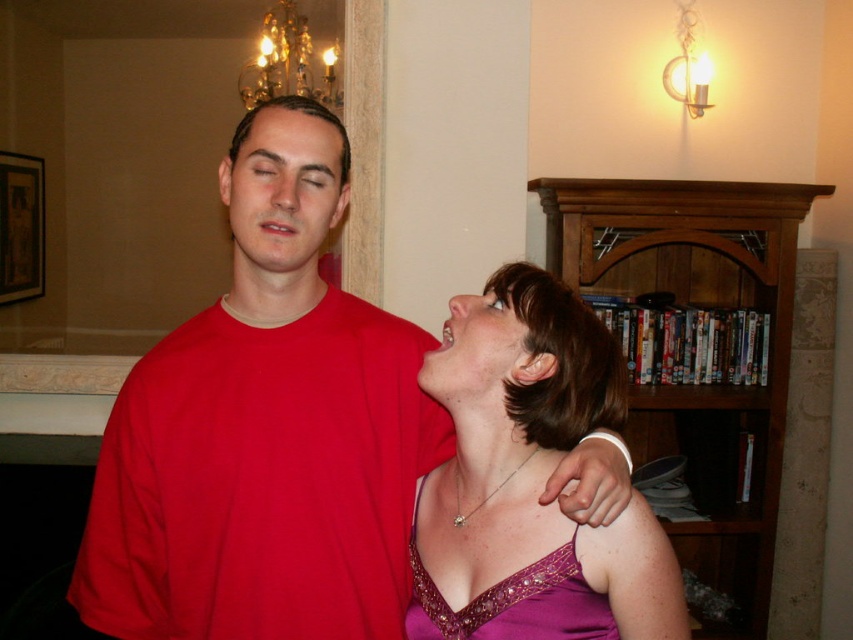
Which of these two, wooden bookshelf at right or purple satin dress at center, stands taller?

Standing taller between the two is wooden bookshelf at right.

Between wooden bookshelf at right and purple satin dress at center, which one is positioned higher?

wooden bookshelf at right is higher up.

Does point (814, 275) come closer to viewer compared to point (564, 598)?

No, (814, 275) is behind (564, 598).

The width and height of the screenshot is (853, 640). Find the location of `wooden bookshelf at right`. wooden bookshelf at right is located at coordinates (699, 355).

Is point (241, 579) positioned after point (653, 520)?

Yes, it is.

Can you confirm if matte red t-shirt at center is positioned above purple satin dress at lower right?

Indeed, matte red t-shirt at center is positioned over purple satin dress at lower right.

Between point (264, 164) and point (474, 608), which one is positioned behind?

The point (264, 164) is behind.

At what (x,y) coordinates should I click in order to perform the action: click on matte red t-shirt at center. Please return your answer as a coordinate pair (x, y). Looking at the image, I should click on (265, 429).

Who is taller, wooden bookshelf at right or matte purple dress at lower right?

wooden bookshelf at right is taller.

Does wooden bookshelf at right appear over matte purple dress at lower right?

Incorrect, wooden bookshelf at right is not positioned above matte purple dress at lower right.

Image resolution: width=853 pixels, height=640 pixels. Describe the element at coordinates (699, 355) in the screenshot. I see `wooden bookshelf at right` at that location.

This screenshot has width=853, height=640. Identify the location of wooden bookshelf at right. (699, 355).